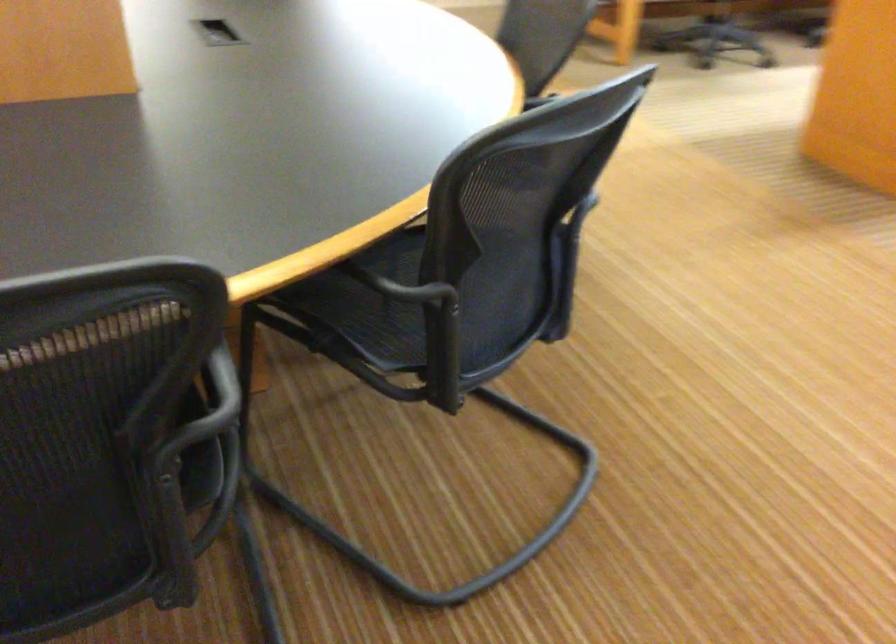
Find where to resting arm the black chair armrest. Please return your answer as a coordinate pair (x, y).

(222, 382)